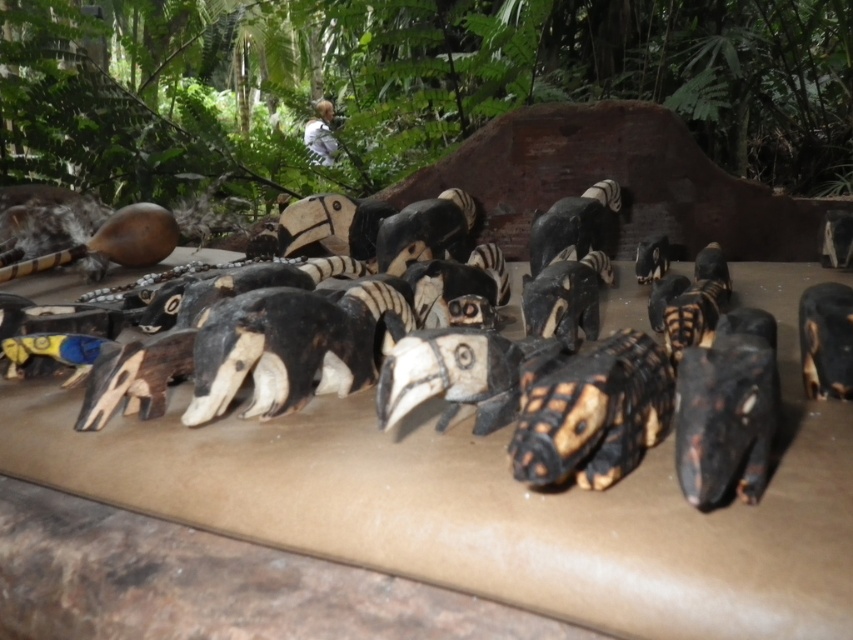
Where is the black wood animal at center located in the image?

The black wood animal at center is located at point (444, 477).

You are a museum curator planning to place a protective glass cover over the black wood animal at center and the black matte hornbill head at lower right. The glass cover can only accommodate items up to 30 cm in width. Based on the scene description, can both items fit comfortably under the glass cover without overlapping?

The black wood animal at center might be wider than black matte hornbill head at lower right. Since the maximum width allowed is 30 cm, it is uncertain if the black wood animal at center will fit without overlapping. Further measurement is needed to confirm.